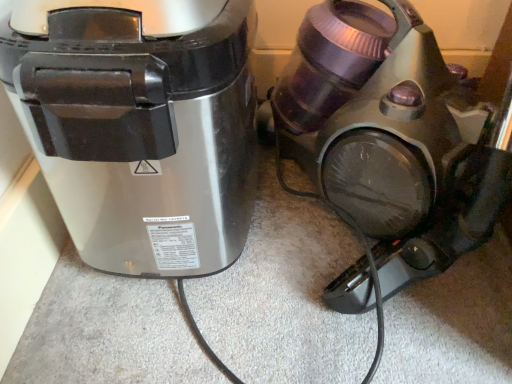
Measure the distance between satin silver appliance at left and camera.

satin silver appliance at left and camera are 13.11 inches apart from each other.

This screenshot has width=512, height=384. What are the coordinates of `satin silver appliance at left` in the screenshot? It's located at (139, 125).

This screenshot has height=384, width=512. Describe the element at coordinates (139, 125) in the screenshot. I see `satin silver appliance at left` at that location.

The height and width of the screenshot is (384, 512). In order to click on satin silver appliance at left in this screenshot , I will do `click(139, 125)`.